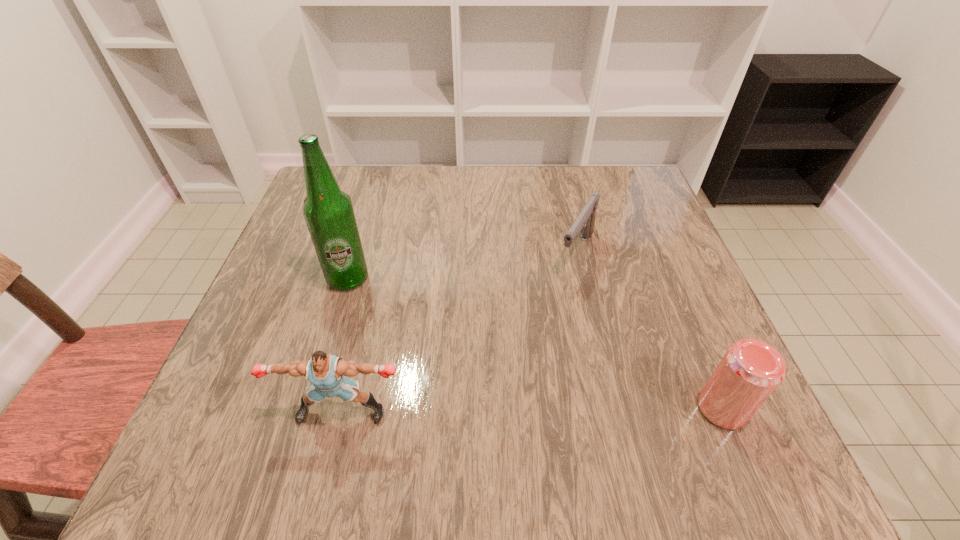
Find the location of `free space located on the label of the tallest object`. free space located on the label of the tallest object is located at coordinates (382, 301).

I want to click on vacant region located 0.060m on the label of the tallest object, so click(382, 301).

Find the location of a particular element. The height and width of the screenshot is (540, 960). puncher that is at the near edge is located at coordinates (325, 373).

You are a GUI agent. You are given a task and a screenshot of the screen. Output one action in this format:
    pyautogui.click(x=<x>, y=<y>)
    Task: Click on the beer can situated at the near edge
    Image resolution: width=960 pixels, height=540 pixels.
    Given the screenshot: What is the action you would take?
    pyautogui.click(x=750, y=371)

Locate an element on the screen. puncher present at the left edge is located at coordinates (325, 373).

What are the coordinates of `beer bottle that is at the left edge` in the screenshot? It's located at click(x=328, y=211).

The height and width of the screenshot is (540, 960). I want to click on object present at the right edge, so click(750, 371).

You are a GUI agent. You are given a task and a screenshot of the screen. Output one action in this format:
    pyautogui.click(x=<x>, y=<y>)
    Task: Click on the object at the near left corner
    
    Given the screenshot: What is the action you would take?
    pyautogui.click(x=325, y=373)

Find the location of a particular element. object at the near right corner is located at coordinates (750, 371).

In the image, there is a desktop. Identify the location of vacant space at the far edge. This screenshot has width=960, height=540. (543, 210).